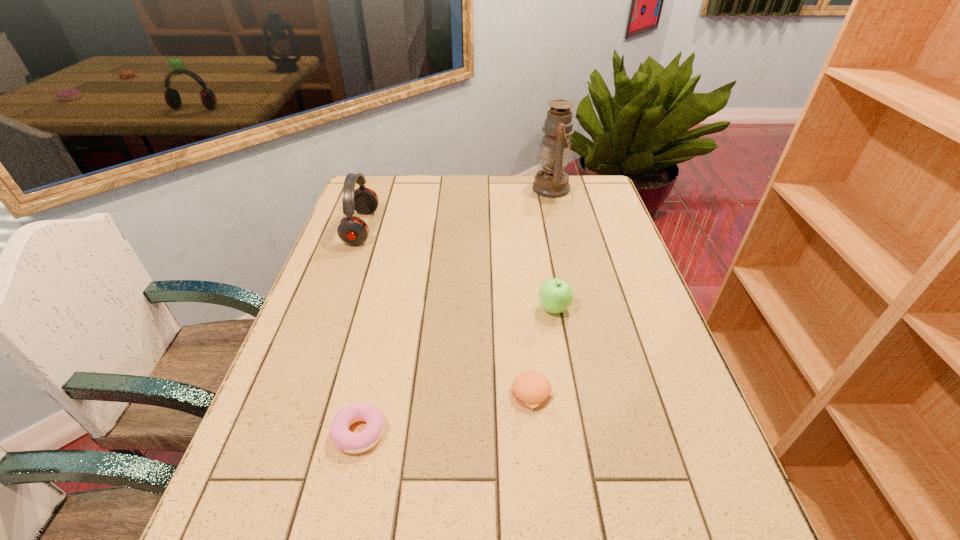
Find the location of `the farthest object`. the farthest object is located at coordinates (552, 182).

The image size is (960, 540). In order to click on the tallest object in this screenshot , I will do `click(552, 182)`.

The width and height of the screenshot is (960, 540). Identify the location of earphone. click(x=352, y=230).

Where is `the leftmost object`? The image size is (960, 540). the leftmost object is located at coordinates (352, 230).

Identify the location of the third shortest object. The height and width of the screenshot is (540, 960). (555, 295).

This screenshot has width=960, height=540. Identify the location of apple. (555, 295).

At what (x,y) coordinates should I click in order to perform the action: click on patty. Please return your answer as a coordinate pair (x, y). Looking at the image, I should click on (530, 389).

This screenshot has height=540, width=960. I want to click on pastry, so click(x=347, y=441).

Locate an element on the screen. Image resolution: width=960 pixels, height=540 pixels. free space located on the front of the farthest object is located at coordinates (564, 230).

Where is `vacant space situated 0.380m on the ear cups of the second tallest object`? This screenshot has height=540, width=960. vacant space situated 0.380m on the ear cups of the second tallest object is located at coordinates (494, 228).